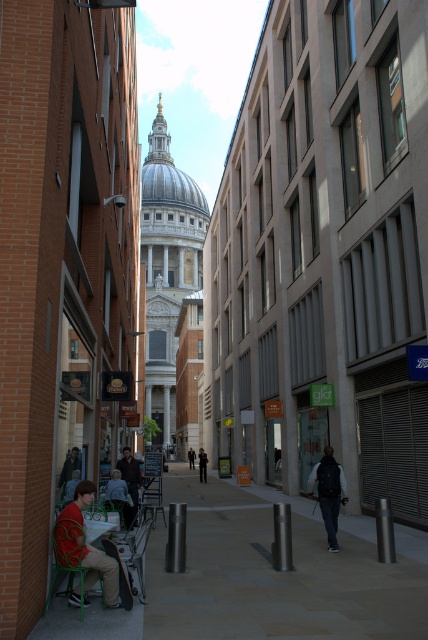
You are a delivery person standing on the smooth concrete pavement at center. You need to place a heavy box on the ground. Is the dark suit at center in a safe location to place the box?

The smooth concrete pavement at center is positioned over the dark suit at center, so placing the box there would directly affect the dark suit at center. Choose another spot to avoid disturbing the person.

You are a pedestrian standing on the street in front of the red brick building with the outdoor seating area. You see a person wearing a red fabric shirt at lower left and a dark gray jacket at lower left. Which clothing item is closer to you?

The red fabric shirt at lower left is closer to the viewer than the dark gray jacket at lower left, so the red fabric shirt at lower left is closer to you.